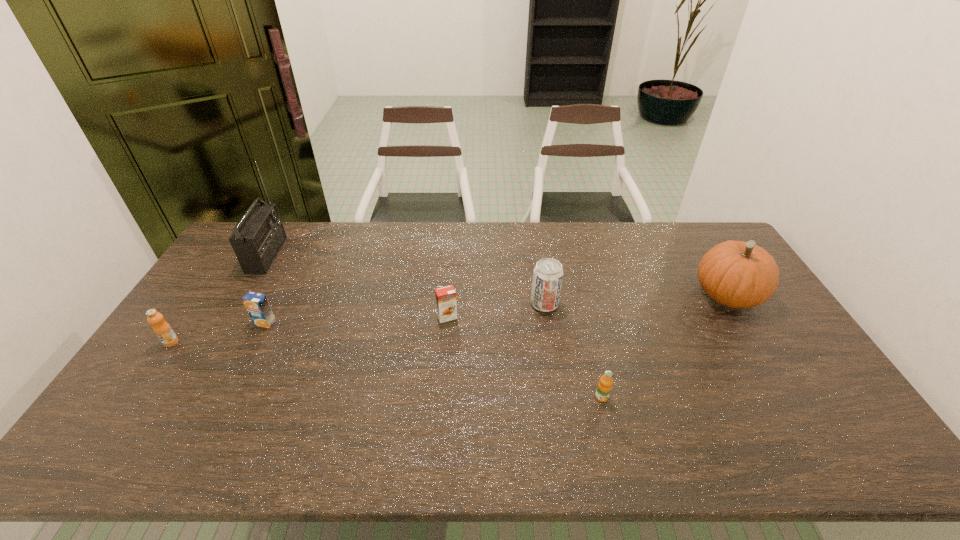
Identify the location of object that is the sixth nearest to the third orange juice from right to left. (736, 274).

This screenshot has height=540, width=960. Identify the location of the third closest object to the second object from left to right. (446, 304).

You are a GUI agent. You are given a task and a screenshot of the screen. Output one action in this format:
    pyautogui.click(x=<x>, y=<y>)
    Task: Click on the orange juice identified as the third closest to the fifth object from right to left
    The image size is (960, 540).
    Given the screenshot: What is the action you would take?
    pyautogui.click(x=604, y=386)

Identify which orange juice is located as the nearest to the second object from left to right. Please provide its 2D coordinates. Your answer should be formatted as a tuple, i.e. [(x, y)], where the tuple contains the x and y coordinates of a point satisfying the conditions above.

[(257, 305)]

Where is `free space that satisfies the following two spatial constraints: 1. on the front panel of the radio receiver; 2. on the back side of the second orange juice from right to left`? The width and height of the screenshot is (960, 540). free space that satisfies the following two spatial constraints: 1. on the front panel of the radio receiver; 2. on the back side of the second orange juice from right to left is located at coordinates (230, 317).

Find the location of `free space that satisfies the following two spatial constraints: 1. on the stem of the rightmost object; 2. on the front label of the second nearest object`. free space that satisfies the following two spatial constraints: 1. on the stem of the rightmost object; 2. on the front label of the second nearest object is located at coordinates (756, 342).

Find the location of a particular element. The image size is (960, 540). free region that satisfies the following two spatial constraints: 1. on the front panel of the radio receiver; 2. on the front label of the second nearest object is located at coordinates (216, 342).

The height and width of the screenshot is (540, 960). Find the location of `free spot that satisfies the following two spatial constraints: 1. on the front panel of the third orange juice from right to left; 2. on the left side of the sixth object from right to left`. free spot that satisfies the following two spatial constraints: 1. on the front panel of the third orange juice from right to left; 2. on the left side of the sixth object from right to left is located at coordinates (228, 323).